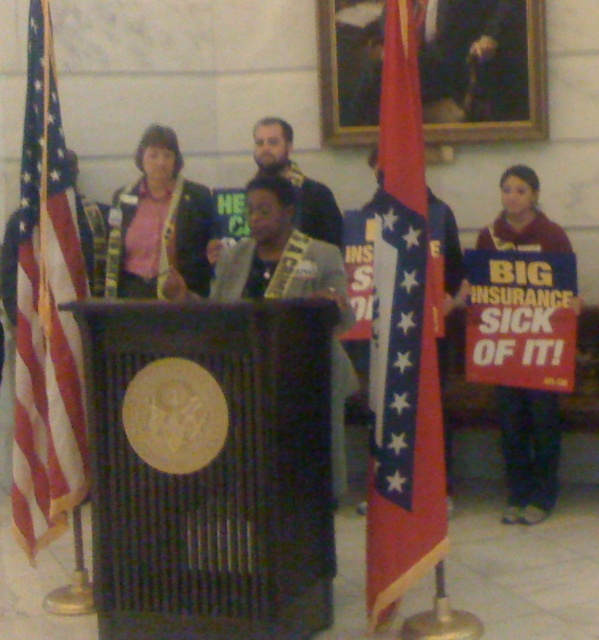
Is point (210, 205) more distant than point (513, 168)?

Yes, it is behind point (513, 168).

At what (x,y) coordinates should I click in order to perform the action: click on matte pink shirt at center. Please return your answer as a coordinate pair (x, y). The height and width of the screenshot is (640, 599). Looking at the image, I should click on (158, 224).

Image resolution: width=599 pixels, height=640 pixels. What do you see at coordinates (158, 224) in the screenshot?
I see `matte pink shirt at center` at bounding box center [158, 224].

I want to click on matte pink shirt at center, so click(x=158, y=224).

Can you confirm if american flag at left is positioned to the left of maroon fabric sign at right?

Yes, american flag at left is to the left of maroon fabric sign at right.

Is american flag at left below maroon fabric sign at right?

No.

The image size is (599, 640). What do you see at coordinates (46, 314) in the screenshot? I see `american flag at left` at bounding box center [46, 314].

At what (x,y) coordinates should I click in order to perform the action: click on american flag at left. Please return your answer as a coordinate pair (x, y). Image resolution: width=599 pixels, height=640 pixels. Looking at the image, I should click on pos(46,314).

Is red fabric flag at center to the left of american flag at left from the viewer's perspective?

No, red fabric flag at center is not to the left of american flag at left.

Who is more distant from viewer, (400, 230) or (78, 502)?

Positioned behind is point (78, 502).

The image size is (599, 640). Find the location of `red fabric flag at center`. red fabric flag at center is located at coordinates (403, 344).